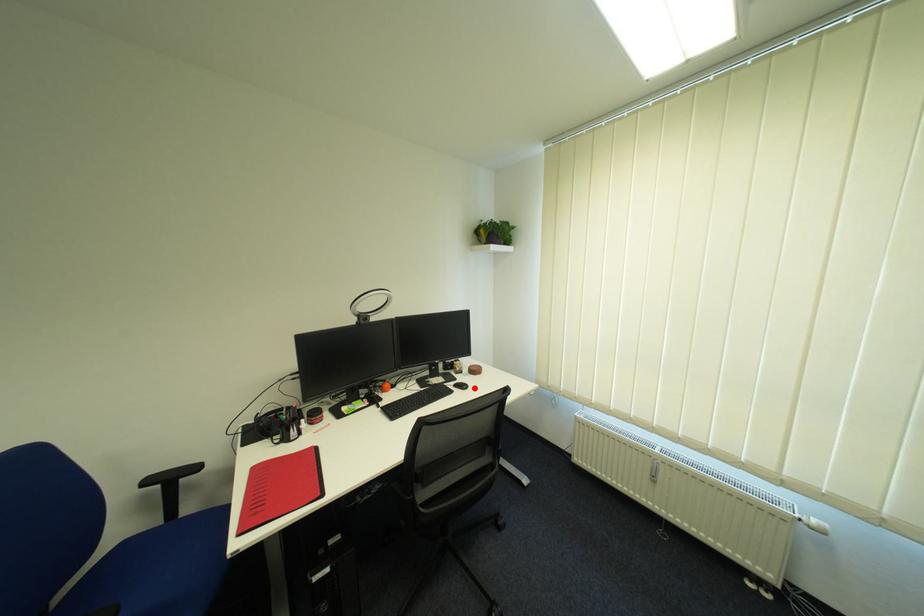
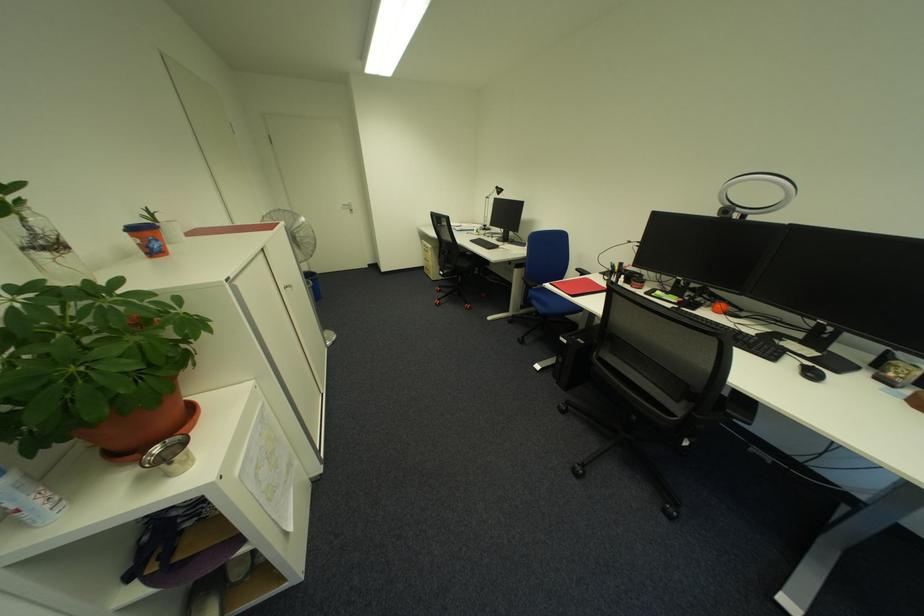
Find the pixel in the second image that matches the highlighted location in the first image.

(820, 376)